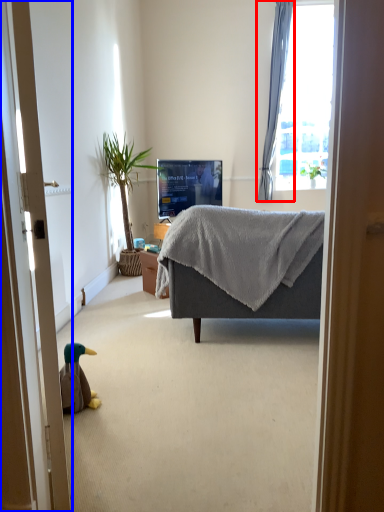
Question: Which object is closer to the camera taking this photo, curtain (highlighted by a red box) or door (highlighted by a blue box)?

Choices:
 (A) curtain
 (B) door

Answer: (B)